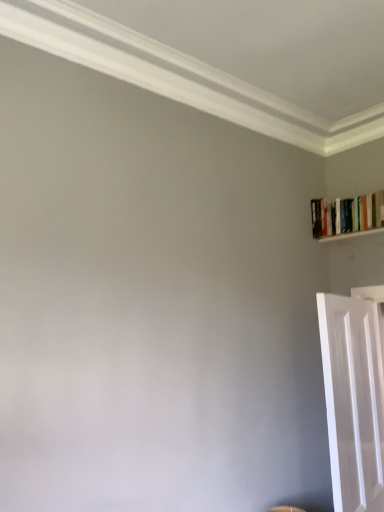
Where is `white glossy door at right`? Image resolution: width=384 pixels, height=512 pixels. white glossy door at right is located at coordinates (353, 400).

What do you see at coordinates (353, 400) in the screenshot?
I see `white glossy door at right` at bounding box center [353, 400].

Find the location of a particular element. The image size is (384, 512). white glossy door at right is located at coordinates [353, 400].